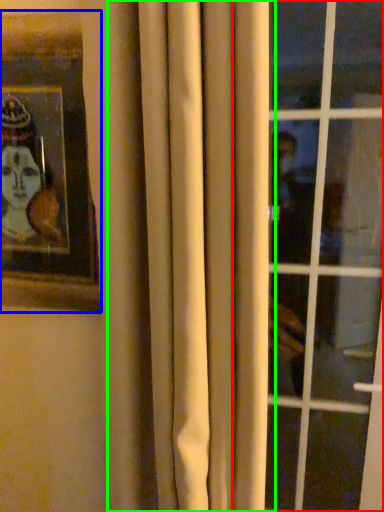
Question: Which object is positioned farthest from window (highlighted by a red box)? Select from picture frame (highlighted by a blue box) and curtain (highlighted by a green box).

Choices:
 (A) picture frame
 (B) curtain

Answer: (A)